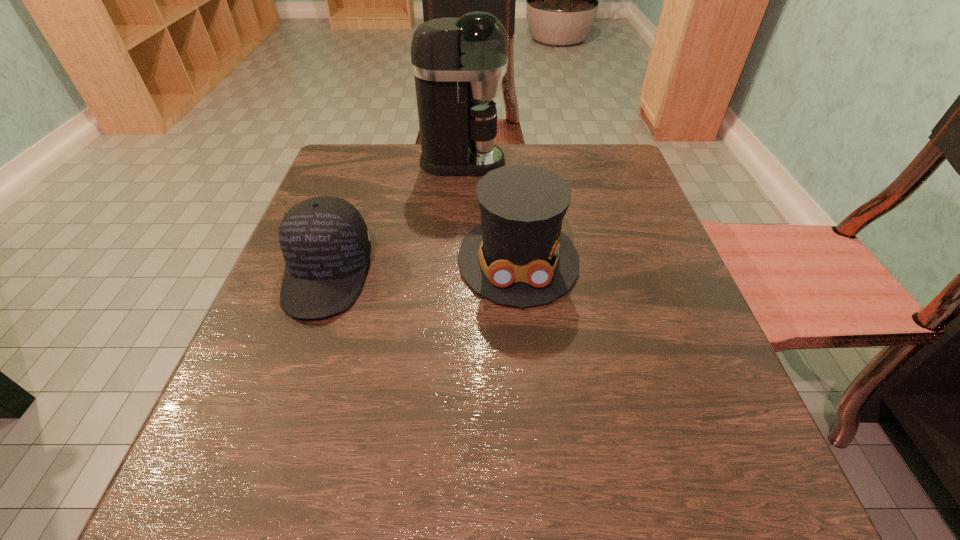
Locate an element on the screen. free space at the far edge is located at coordinates (415, 152).

You are a GUI agent. You are given a task and a screenshot of the screen. Output one action in this format:
    pyautogui.click(x=<x>, y=<y>)
    Task: Click on the vacant area at the near edge of the desktop
    
    Given the screenshot: What is the action you would take?
    pyautogui.click(x=406, y=471)

In order to click on vacant area at the left edge of the desktop in this screenshot , I will do `click(377, 228)`.

Image resolution: width=960 pixels, height=540 pixels. In the image, there is a desktop. Find the location of `vacant space at the right edge`. vacant space at the right edge is located at coordinates (647, 449).

This screenshot has height=540, width=960. In the image, there is a desktop. Identify the location of vacant space at the far left corner. (378, 163).

You are a GUI agent. You are given a task and a screenshot of the screen. Output one action in this format:
    pyautogui.click(x=<x>, y=<y>)
    Task: Click on the vacant space at the near left corner of the desktop
    
    Given the screenshot: What is the action you would take?
    pyautogui.click(x=231, y=492)

This screenshot has width=960, height=540. Find the location of `free space at the far right corner`. free space at the far right corner is located at coordinates (583, 152).

Locate an element on the screen. empty location between the leftmost object and the dress hat is located at coordinates (422, 267).

Where is `free space that is in between the shortest object and the tallest object`? Image resolution: width=960 pixels, height=540 pixels. free space that is in between the shortest object and the tallest object is located at coordinates (395, 218).

You are a GUI agent. You are given a task and a screenshot of the screen. Output one action in this format:
    pyautogui.click(x=<x>, y=<y>)
    Task: Click on the free space between the dress hat and the shortest object
    Image resolution: width=960 pixels, height=540 pixels.
    Given the screenshot: What is the action you would take?
    pyautogui.click(x=422, y=267)